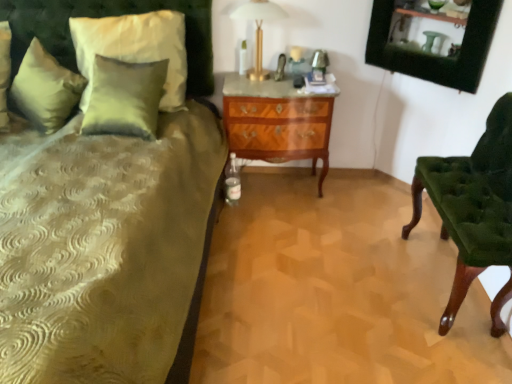
Question: Considering the relative sizes of satin green pillow at upper left, the 2th pillow viewed from the right, and velvet green headboard at upper left in the image provided, is satin green pillow at upper left, the 2th pillow viewed from the right, shorter than velvet green headboard at upper left?

Choices:
 (A) yes
 (B) no

Answer: (A)

Question: Can you confirm if satin green pillow at upper left, the 2th pillow viewed from the right, is taller than velvet green headboard at upper left?

Choices:
 (A) no
 (B) yes

Answer: (A)

Question: Is satin green pillow at upper left, the 2th pillow viewed from the right, far away from velvet green headboard at upper left?

Choices:
 (A) no
 (B) yes

Answer: (A)

Question: From the image's perspective, would you say satin green pillow at upper left, acting as the first pillow starting from the left, is shown under velvet green headboard at upper left?

Choices:
 (A) yes
 (B) no

Answer: (A)

Question: Considering the relative sizes of satin green pillow at upper left, the 2th pillow viewed from the right, and velvet green headboard at upper left in the image provided, is satin green pillow at upper left, the 2th pillow viewed from the right, smaller than velvet green headboard at upper left?

Choices:
 (A) yes
 (B) no

Answer: (A)

Question: Looking at the image, does velvet green headboard at upper left seem bigger or smaller compared to velvet green chair at right?

Choices:
 (A) small
 (B) big

Answer: (A)

Question: In the image, is velvet green headboard at upper left on the left side or the right side of velvet green chair at right?

Choices:
 (A) left
 (B) right

Answer: (A)

Question: From the image's perspective, is velvet green headboard at upper left located above or below velvet green chair at right?

Choices:
 (A) above
 (B) below

Answer: (A)

Question: Relative to velvet green chair at right, is velvet green headboard at upper left in front or behind?

Choices:
 (A) behind
 (B) front

Answer: (A)

Question: From a real-world perspective, is satin green pillow at upper left, the 2th pillow viewed from the right, above or below velvet green chair at right?

Choices:
 (A) below
 (B) above

Answer: (B)

Question: Would you say satin green pillow at upper left, the 2th pillow viewed from the right, is to the left or to the right of velvet green chair at right in the picture?

Choices:
 (A) left
 (B) right

Answer: (A)

Question: Considering the positions of point (71, 89) and point (456, 312), is point (71, 89) closer or farther from the camera than point (456, 312)?

Choices:
 (A) farther
 (B) closer

Answer: (A)

Question: In terms of width, does satin green pillow at upper left, the 2th pillow viewed from the right, look wider or thinner when compared to velvet green chair at right?

Choices:
 (A) wide
 (B) thin

Answer: (A)

Question: From a real-world perspective, is satin green pillow at upper left, the 1th pillow when ordered from right to left, physically located above or below velvet green headboard at upper left?

Choices:
 (A) below
 (B) above

Answer: (A)

Question: From the image's perspective, is satin green pillow at upper left, placed as the second pillow when sorted from left to right, positioned above or below velvet green headboard at upper left?

Choices:
 (A) above
 (B) below

Answer: (B)